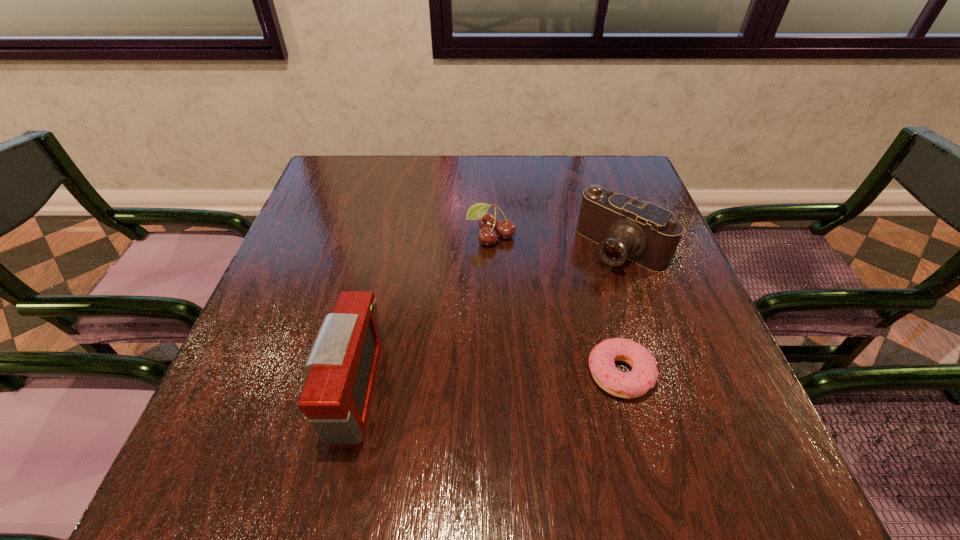
The width and height of the screenshot is (960, 540). What are the coordinates of `unoccupied area between the shorter camera and the third tallest object` in the screenshot? It's located at coord(557,242).

Find the location of a particular element. The width and height of the screenshot is (960, 540). vacant area between the second object from left to right and the shortest object is located at coordinates (555, 306).

This screenshot has height=540, width=960. What are the coordinates of `empty location between the doughnut and the leftmost object` in the screenshot? It's located at point(485,382).

Where is `free space between the left camera and the doughnut`? The width and height of the screenshot is (960, 540). free space between the left camera and the doughnut is located at coordinates (485, 382).

In order to click on free space between the shortest object and the third object from right to left in this screenshot , I will do `click(555, 306)`.

The width and height of the screenshot is (960, 540). In order to click on free space between the tallest object and the shortest object in this screenshot , I will do pyautogui.click(x=485, y=382).

Locate an element on the screen. The width and height of the screenshot is (960, 540). empty space between the taller camera and the shorter camera is located at coordinates (486, 319).

The image size is (960, 540). I want to click on the third closest object to the third tallest object, so click(643, 376).

Point out which object is positioned as the second nearest to the doughnut. Please provide its 2D coordinates. Your answer should be formatted as a tuple, i.e. [(x, y)], where the tuple contains the x and y coordinates of a point satisfying the conditions above.

[(488, 222)]

I want to click on blank area in the image that satisfies the following two spatial constraints: 1. on the front side of the second tallest object; 2. on the right side of the second object from left to right, so click(492, 248).